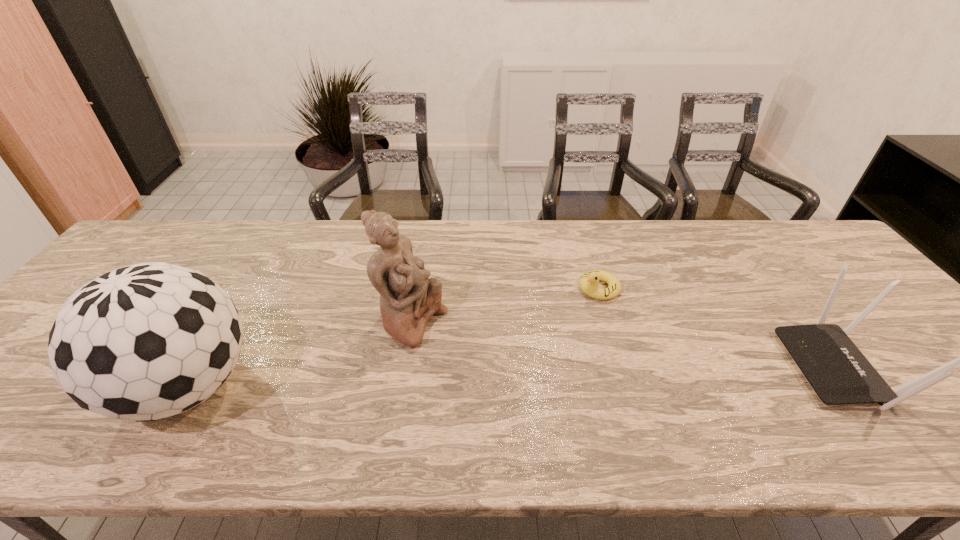
Locate an element on the screen. This screenshot has width=960, height=540. vacant spot on the desktop that is between the leftmost object and the third tallest object and is positioned on the face of the duckling is located at coordinates (453, 379).

Where is `free space on the desktop that is between the soccer ball and the third tallest object and is positioned on the front-facing side of the figurine`? The height and width of the screenshot is (540, 960). free space on the desktop that is between the soccer ball and the third tallest object and is positioned on the front-facing side of the figurine is located at coordinates (532, 377).